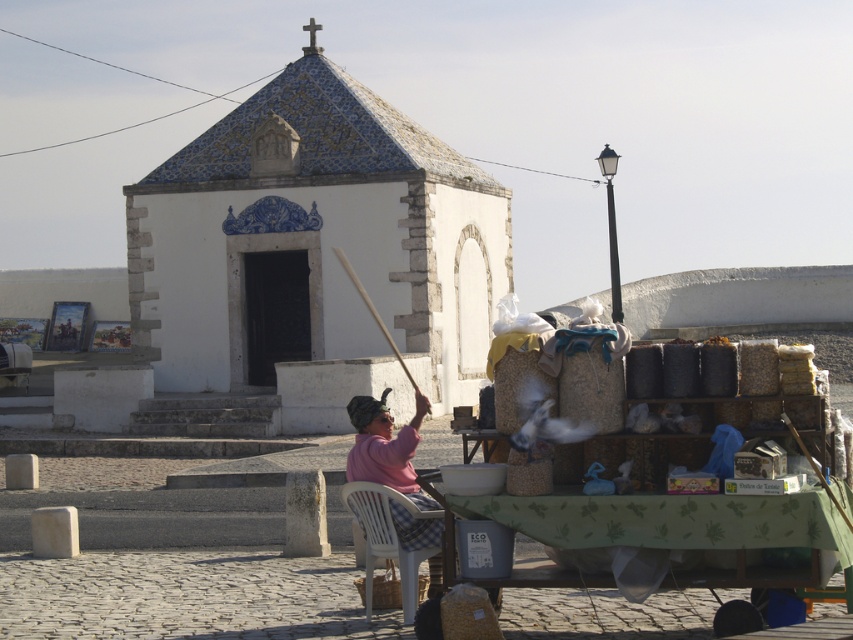
You are standing at the chapel entrance and want to walk to the street vendor cart. Which point should you walk towards first, point (808, 525) or point (397, 460)?

You should walk towards point (808, 525) first because it is in front of point (397, 460), meaning it is closer to your current position at the chapel entrance.